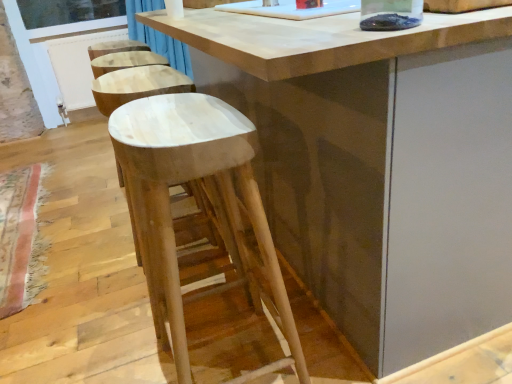
Locate an element on the screen. Image resolution: width=512 pixels, height=384 pixels. vacant location below natural wood stool at center (from a real-world perspective) is located at coordinates (223, 355).